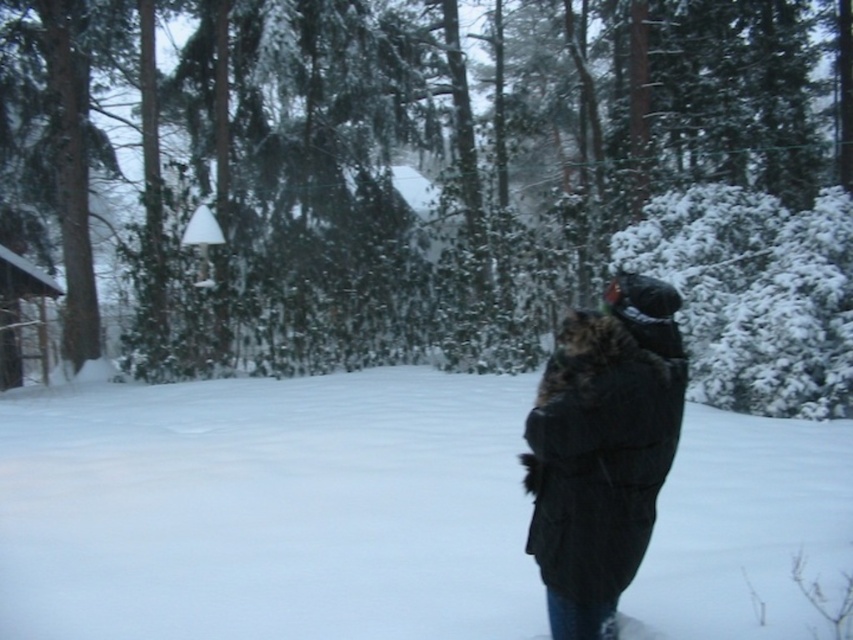
Question: Among these objects, which one is farthest from the camera?

Choices:
 (A) wooden cabin at left
 (B) snow-covered evergreen tree at center

Answer: (A)

Question: Can you confirm if white fluffy snow at center is thinner than wooden cabin at left?

Choices:
 (A) no
 (B) yes

Answer: (A)

Question: Is snow-covered evergreen tree at center above dark fur coat at center?

Choices:
 (A) yes
 (B) no

Answer: (A)

Question: Does snow-covered evergreen tree at center appear over white fluffy snow at center?

Choices:
 (A) no
 (B) yes

Answer: (B)

Question: Among these points, which one is nearest to the camera?

Choices:
 (A) (431, 456)
 (B) (648, 352)
 (C) (25, 372)

Answer: (B)

Question: Which point is closer to the camera?

Choices:
 (A) snow-covered evergreen tree at center
 (B) white fluffy snow at center

Answer: (B)